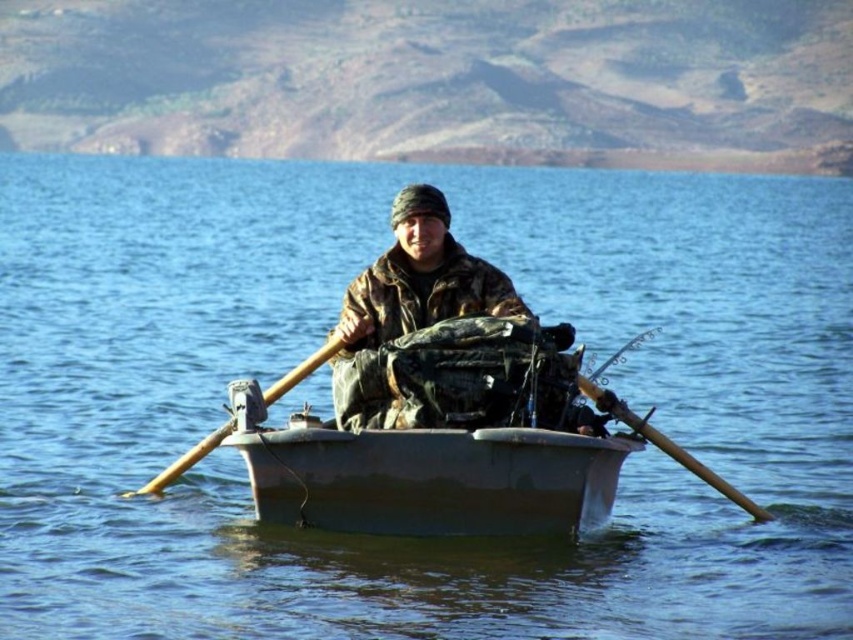
Is gray matte canoe at center above yellow wood paddle at center?

No.

Which is below, gray matte canoe at center or yellow wood paddle at center?

gray matte canoe at center is lower down.

This screenshot has height=640, width=853. Find the location of `gray matte canoe at center`. gray matte canoe at center is located at coordinates (431, 477).

How much distance is there between gray matte canoe at center and camouflage fabric jacket at center?

A distance of 12.45 feet exists between gray matte canoe at center and camouflage fabric jacket at center.

Which is in front, point (550, 522) or point (392, 404)?

Positioned in front is point (550, 522).

Identify the location of gray matte canoe at center. The width and height of the screenshot is (853, 640). (431, 477).

From the picture: Which is more to the right, camouflage fabric jacket at center or wooden at right?

Positioned to the right is wooden at right.

Does camouflage fabric jacket at center have a greater height compared to wooden at right?

Indeed, camouflage fabric jacket at center has a greater height compared to wooden at right.

Between point (416, 248) and point (579, 381), which one is positioned in front?

Point (579, 381) is more forward.

Identify the location of camouflage fabric jacket at center. (422, 328).